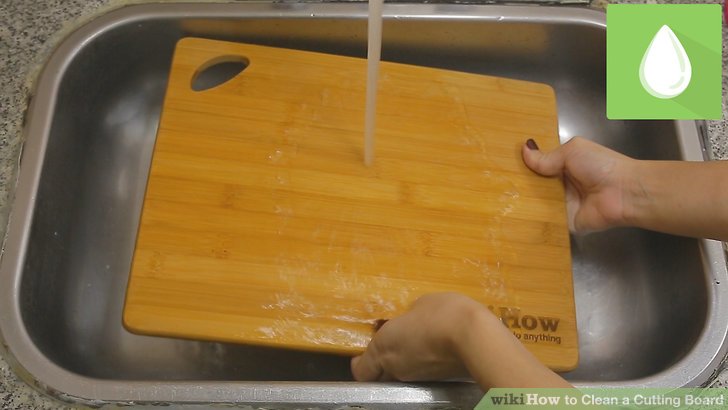
The image size is (728, 410). Find the location of `cutting board`. cutting board is located at coordinates (534, 98).